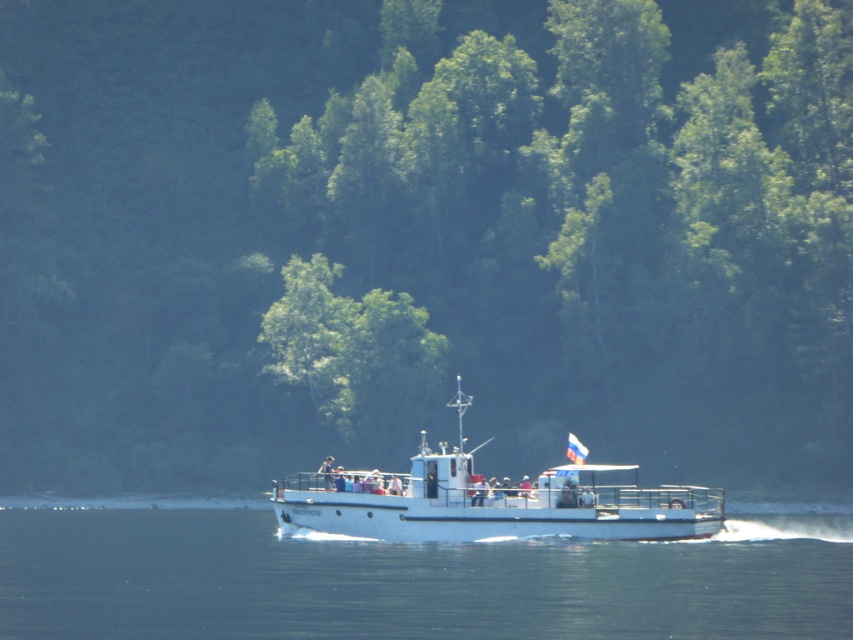
Does white matte boat at center have a lesser width compared to green leafy tree at center?

No, white matte boat at center is not thinner than green leafy tree at center.

Is point (347, 515) farther from viewer compared to point (357, 385)?

No.

Where is `white matte boat at center`? The height and width of the screenshot is (640, 853). white matte boat at center is located at coordinates (492, 502).

Does clear blue water at center have a smaller size compared to green leafy tree at center?

No.

Is point (461, 612) less distant than point (323, 301)?

Yes, it is in front of point (323, 301).

Where is `clear blue water at center`? The image size is (853, 640). clear blue water at center is located at coordinates (410, 580).

This screenshot has width=853, height=640. I want to click on clear blue water at center, so click(x=410, y=580).

Is clear blue water at center above white matte boat at center?

No.

Which is behind, point (0, 627) or point (418, 483)?

Point (418, 483)

This screenshot has width=853, height=640. I want to click on clear blue water at center, so click(410, 580).